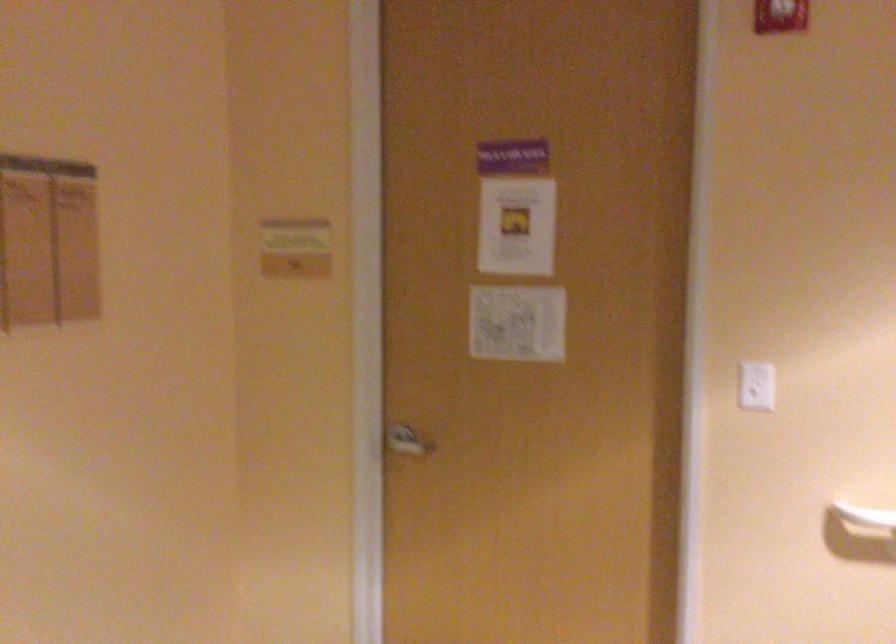
The width and height of the screenshot is (896, 644). Identify the location of silver door handle. (407, 442).